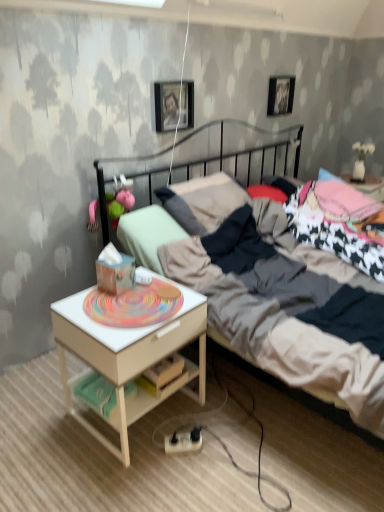
Where is `free space above white wood nightstand at lower left (from a real-world perspective)`? free space above white wood nightstand at lower left (from a real-world perspective) is located at coordinates 134,302.